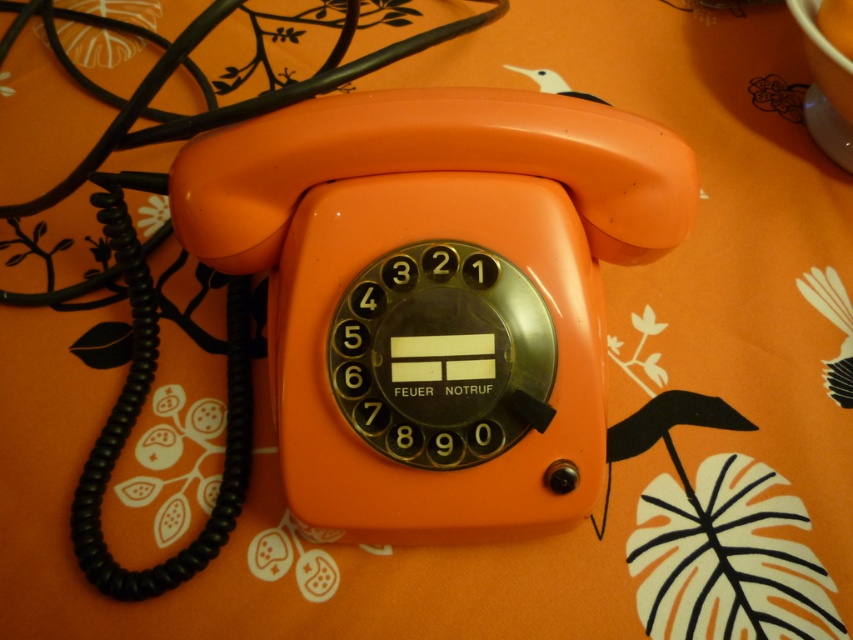
How far apart are orange matte phone at center and matte plastic cup at upper center?

28.45 inches

Is orange matte phone at center shorter than matte plastic cup at upper center?

No, orange matte phone at center is not shorter than matte plastic cup at upper center.

Does point (657, 204) come in front of point (822, 20)?

That is True.

Image resolution: width=853 pixels, height=640 pixels. In order to click on orange matte phone at center in this screenshot , I will do (434, 294).